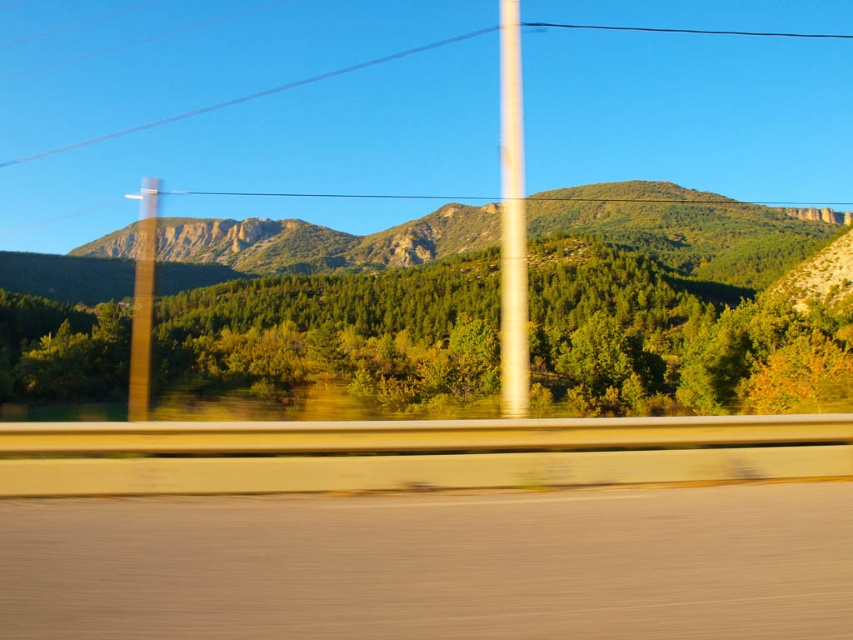
Question: Considering the relative positions of smooth asphalt highway at lower center and green leafy tree at center in the image provided, where is smooth asphalt highway at lower center located with respect to green leafy tree at center?

Choices:
 (A) above
 (B) below

Answer: (B)

Question: Which of the following is the farthest from the observer?

Choices:
 (A) green textured mountain at center
 (B) green leafy tree at center

Answer: (A)

Question: Which of the following is the farthest from the observer?

Choices:
 (A) click(316, 269)
 (B) click(474, 497)

Answer: (A)

Question: Can you confirm if green leafy tree at center is thinner than green textured mountain at center?

Choices:
 (A) no
 (B) yes

Answer: (B)

Question: Does smooth asphalt highway at lower center have a smaller size compared to green textured mountain at center?

Choices:
 (A) yes
 (B) no

Answer: (A)

Question: Which object appears farthest from the camera in this image?

Choices:
 (A) green textured mountain at center
 (B) smooth asphalt highway at lower center
 (C) green leafy tree at center

Answer: (A)